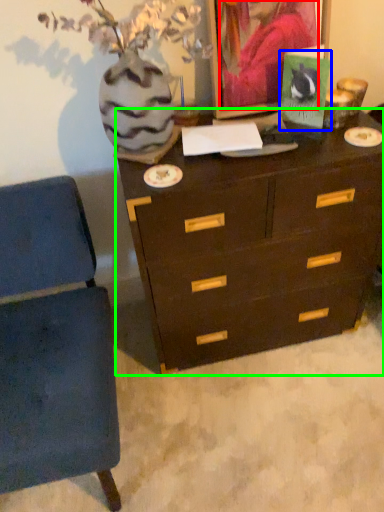
Question: Estimate the real-world distances between objects in this image. Which object is closer to person (highlighted by a red box), postcard (highlighted by a blue box) or chest of drawers (highlighted by a green box)?

Choices:
 (A) postcard
 (B) chest of drawers

Answer: (A)